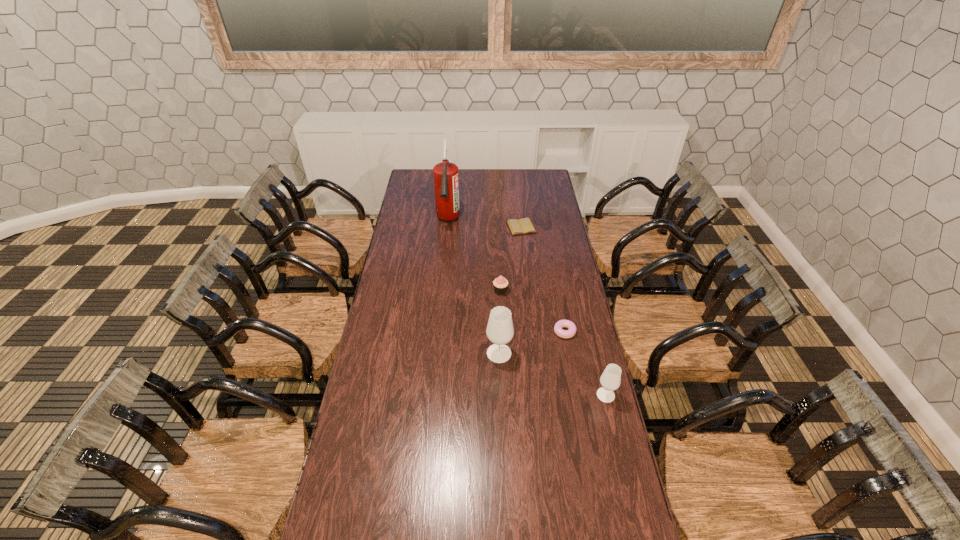
The image size is (960, 540). Find the location of `free point that keeps the glasss evenly spaced on the left`. free point that keeps the glasss evenly spaced on the left is located at coordinates (408, 318).